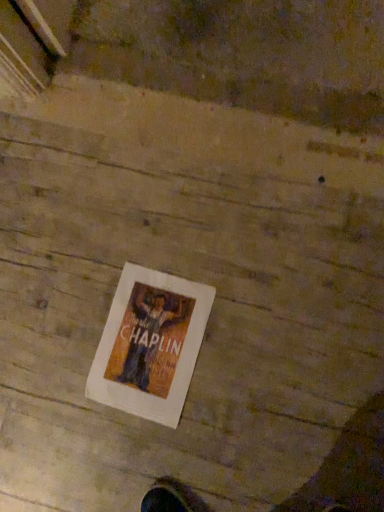
Find the location of `unoccupied area behind white paper poster at center`. unoccupied area behind white paper poster at center is located at coordinates (94, 258).